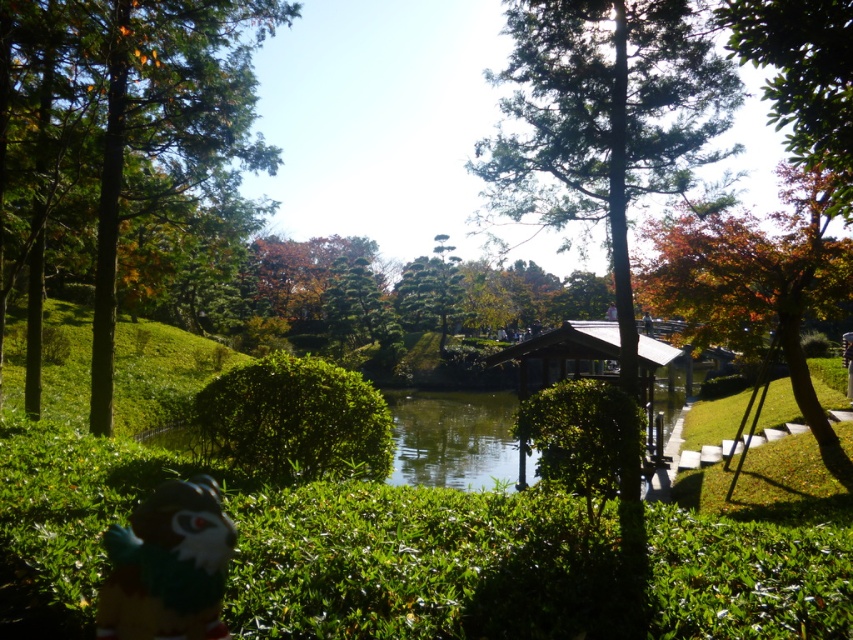
Does point (204, 16) lie in front of point (614, 115)?

That is False.

Does green leafy bush at center have a larger size compared to green textured tree at center?

Correct, green leafy bush at center is larger in size than green textured tree at center.

This screenshot has height=640, width=853. Describe the element at coordinates (120, 144) in the screenshot. I see `green leafy bush at center` at that location.

The width and height of the screenshot is (853, 640). What are the coordinates of `green leafy bush at center` in the screenshot? It's located at (120, 144).

Is green textured tree at center smaller than green leafy tree at upper right?

Actually, green textured tree at center might be larger than green leafy tree at upper right.

Is point (518, 1) positioned before point (788, 104)?

No, (518, 1) is behind (788, 104).

Measure the distance between point (715, 122) and camera.

They are 9.67 meters apart.

Find the location of a particular element. green textured tree at center is located at coordinates [605, 120].

Does green leafy tree at upper right have a lesser width compared to green textured pine tree at center?

Yes.

Does green leafy tree at upper right have a greater width compared to green textured pine tree at center?

No.

Does point (813, 45) come closer to viewer compared to point (442, 236)?

Yes.

Locate an element on the screen. The height and width of the screenshot is (640, 853). green leafy tree at upper right is located at coordinates tap(804, 77).